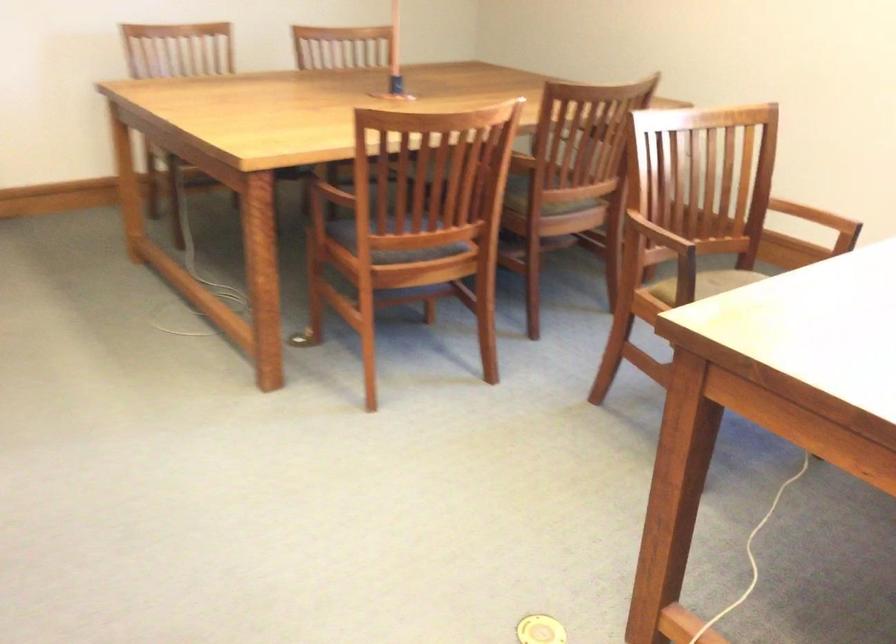
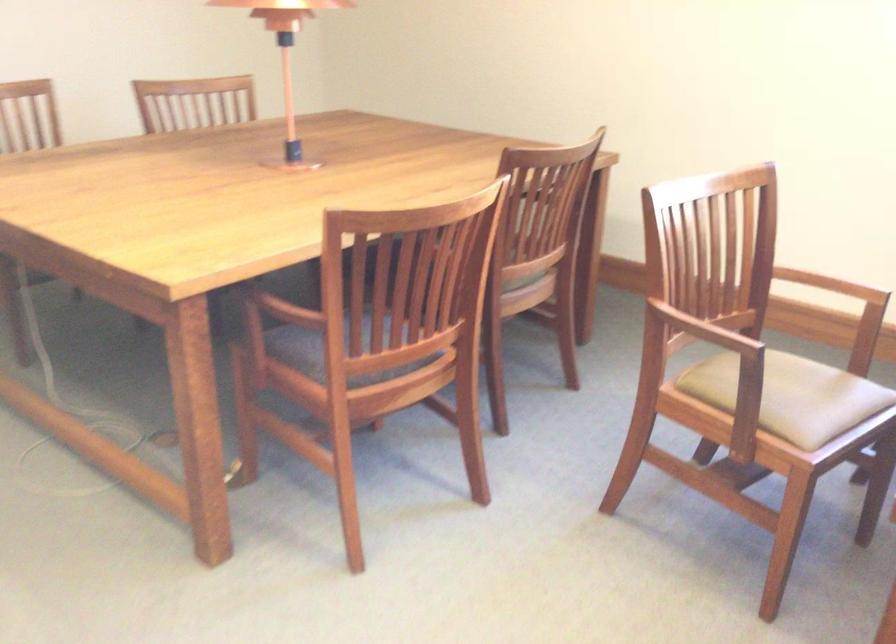
The point at (812, 218) is marked in the first image. Where is the corresponding point in the second image?

(832, 285)